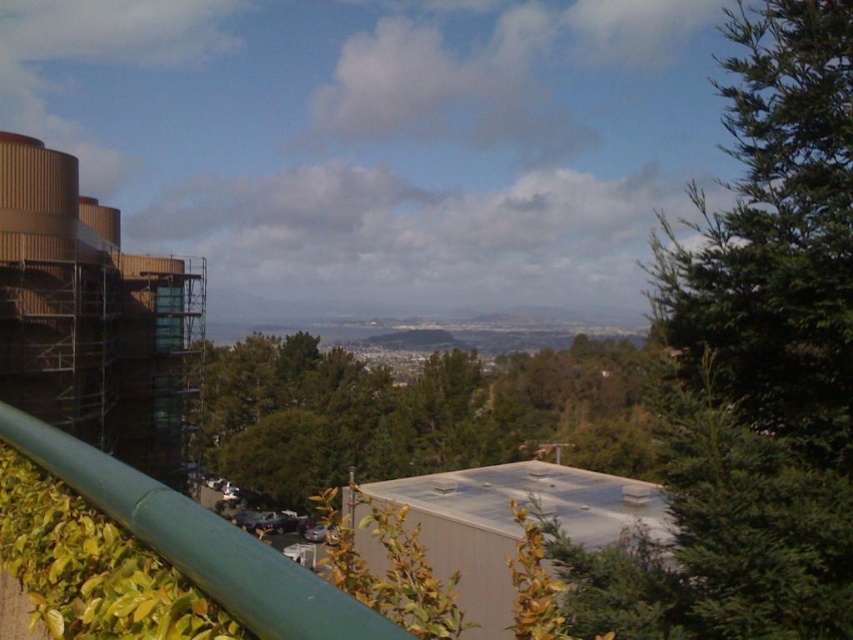
Question: Can you confirm if green textured tree at upper right is positioned above green leafy tree at center?

Choices:
 (A) yes
 (B) no

Answer: (A)

Question: Which point appears closest to the camera in this image?

Choices:
 (A) (709, 566)
 (B) (515, 394)

Answer: (A)

Question: Is green textured tree at upper right behind green leafy tree at center?

Choices:
 (A) yes
 (B) no

Answer: (B)

Question: Considering the relative positions of green textured tree at upper right and green leafy tree at center in the image provided, where is green textured tree at upper right located with respect to green leafy tree at center?

Choices:
 (A) left
 (B) right

Answer: (A)

Question: Among these objects, which one is nearest to the camera?

Choices:
 (A) green textured tree at upper right
 (B) green leafy tree at center

Answer: (A)